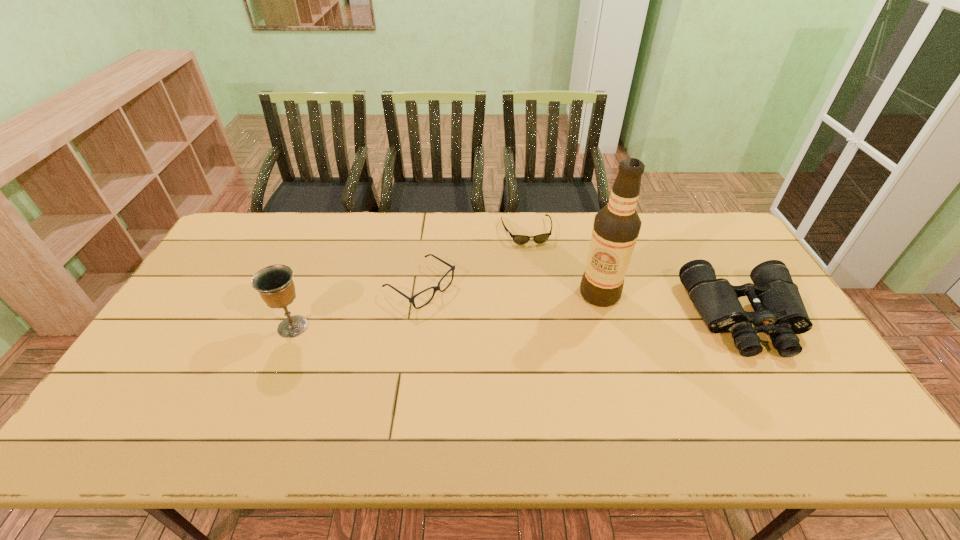
I want to click on free space that satisfies the following two spatial constraints: 1. on the back side of the fourth tallest object; 2. on the left side of the fourth shortest object, so click(x=309, y=287).

Identify the location of free space that satisfies the following two spatial constraints: 1. on the back side of the leftmost object; 2. on the left side of the alcohol. The height and width of the screenshot is (540, 960). (306, 294).